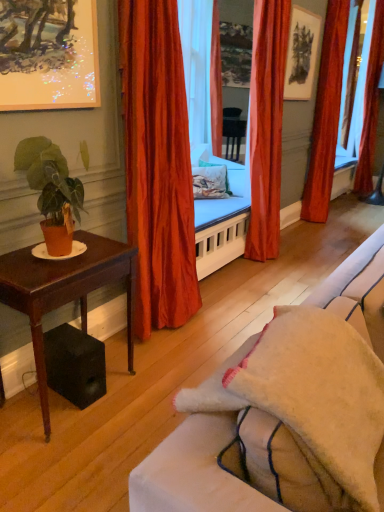
Locate an element on the screen. free space on the front side of satin orange curtain at center, the fourth curtain positioned from the back is located at coordinates (168, 356).